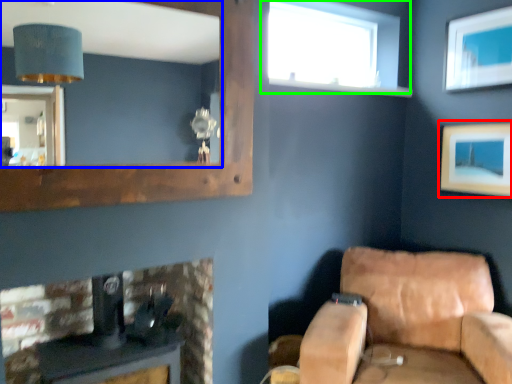
Question: Which is nearer to the picture frame (highlighted by a red box)? mirror (highlighted by a blue box) or window (highlighted by a green box).

Choices:
 (A) mirror
 (B) window

Answer: (B)